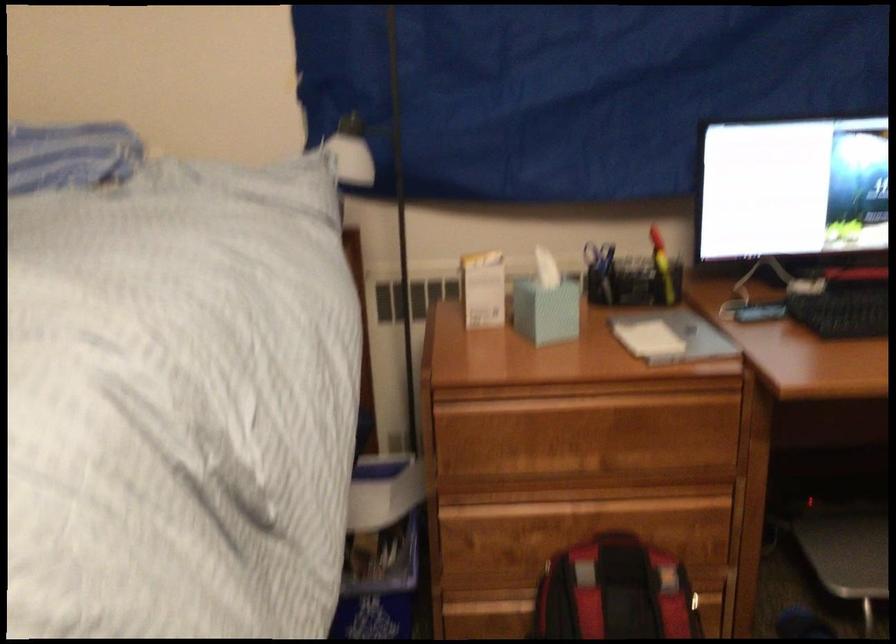
The height and width of the screenshot is (644, 896). Describe the element at coordinates (545, 270) in the screenshot. I see `the tissue box opening` at that location.